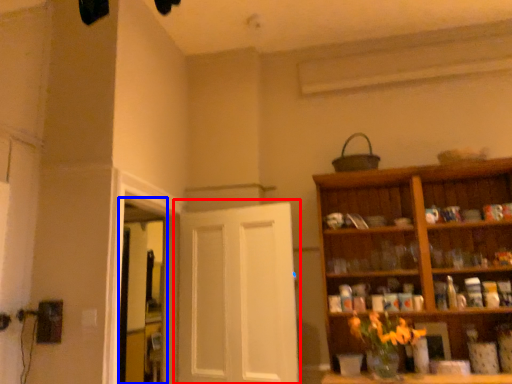
Question: Among these objects, which one is nearest to the camera, door (highlighted by a red box) or window (highlighted by a blue box)?

Choices:
 (A) door
 (B) window

Answer: (A)